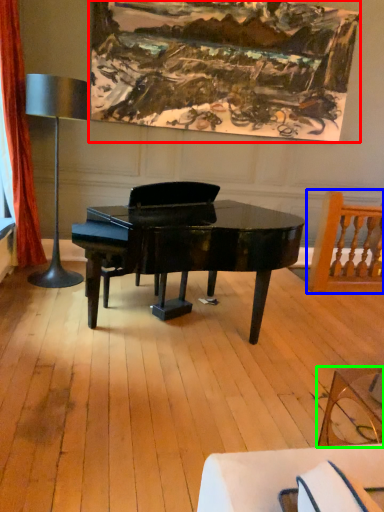
Question: Considering the real-world distances, which object is farthest from picture frame (highlighted by a red box)? chair (highlighted by a blue box) or coffee table (highlighted by a green box)?

Choices:
 (A) chair
 (B) coffee table

Answer: (B)